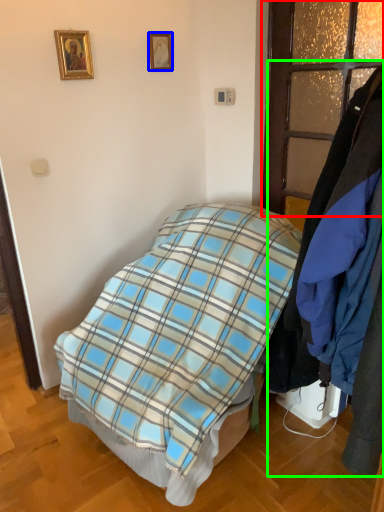
Question: Estimate the real-world distances between objects in this image. Which object is farther from glass door (highlighted by a red box), picture frame (highlighted by a blue box) or closet (highlighted by a green box)?

Choices:
 (A) picture frame
 (B) closet

Answer: (B)